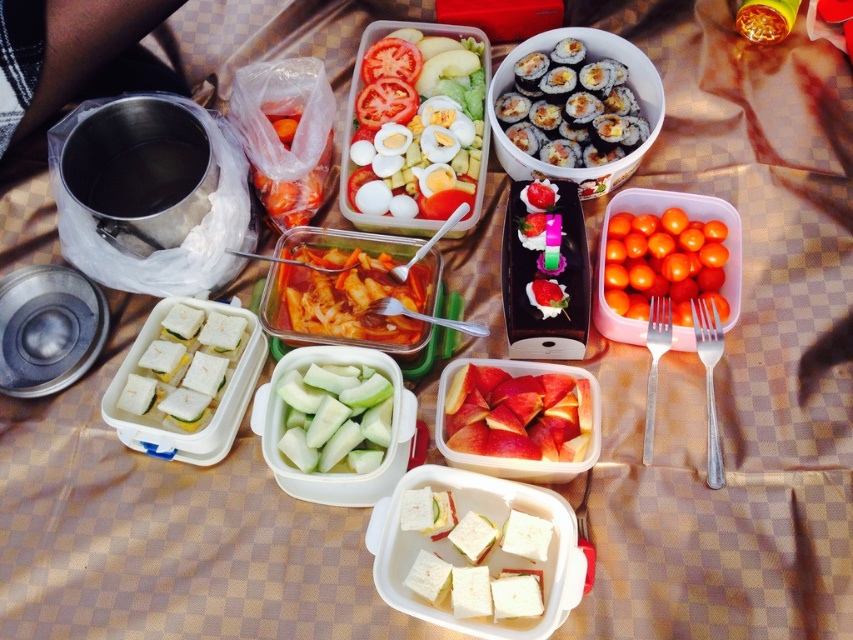
Is white sandwich at center wider than smooth red sauce at center?

Incorrect, white sandwich at center's width does not surpass smooth red sauce at center's.

Who is shorter, white sandwich at center or smooth red sauce at center?

smooth red sauce at center is shorter.

The image size is (853, 640). What are the coordinates of `white sandwich at center` in the screenshot? It's located at (180, 365).

This screenshot has height=640, width=853. In order to click on pink matte apple slices at center in this screenshot , I will do `click(518, 413)`.

Between point (543, 412) and point (289, 252), which one is positioned in front?

Point (543, 412) is more forward.

Measure the distance between pink matte apple slices at center and camera.

pink matte apple slices at center is 38.05 inches away from camera.

Locate an element on the screen. Image resolution: width=853 pixels, height=640 pixels. pink matte apple slices at center is located at coordinates (518, 413).

Is white sandwich at center positioned at the back of bright orange tomatoes at right?

That is False.

Based on the photo, who is lower down, white sandwich at center or bright orange tomatoes at right?

white sandwich at center

Does point (144, 337) come farther from viewer compared to point (659, 284)?

No, it is in front of (659, 284).

This screenshot has height=640, width=853. Identify the location of white sandwich at center. (180, 365).